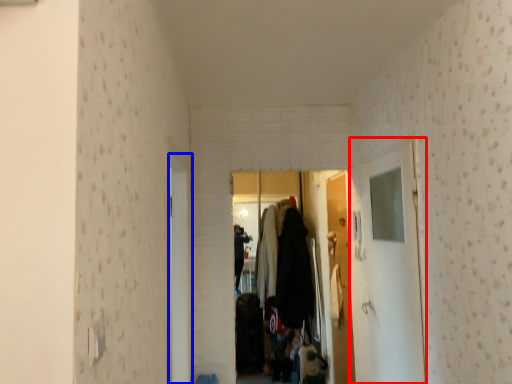
Question: Which object appears closest to the camera in this image, glass door (highlighted by a red box) or door (highlighted by a blue box)?

Choices:
 (A) glass door
 (B) door

Answer: (B)